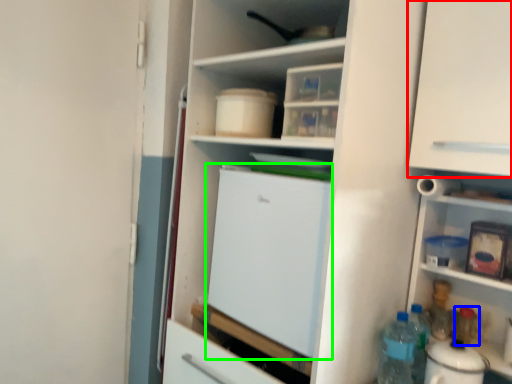
Question: Which object is positioned closest to cabinetry (highlighted by a red box)? Select from bottle (highlighted by a blue box) and refrigerator (highlighted by a green box).

Choices:
 (A) bottle
 (B) refrigerator

Answer: (B)